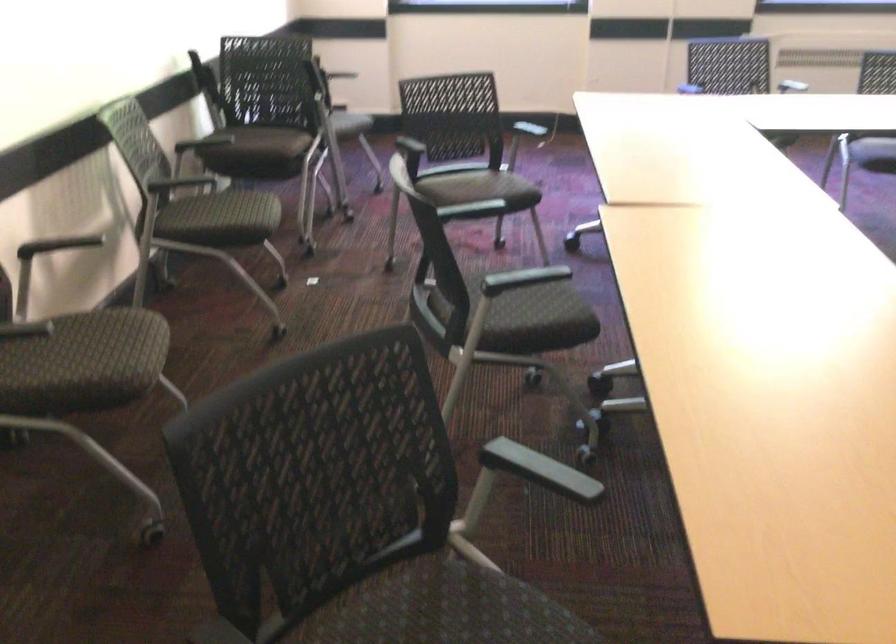
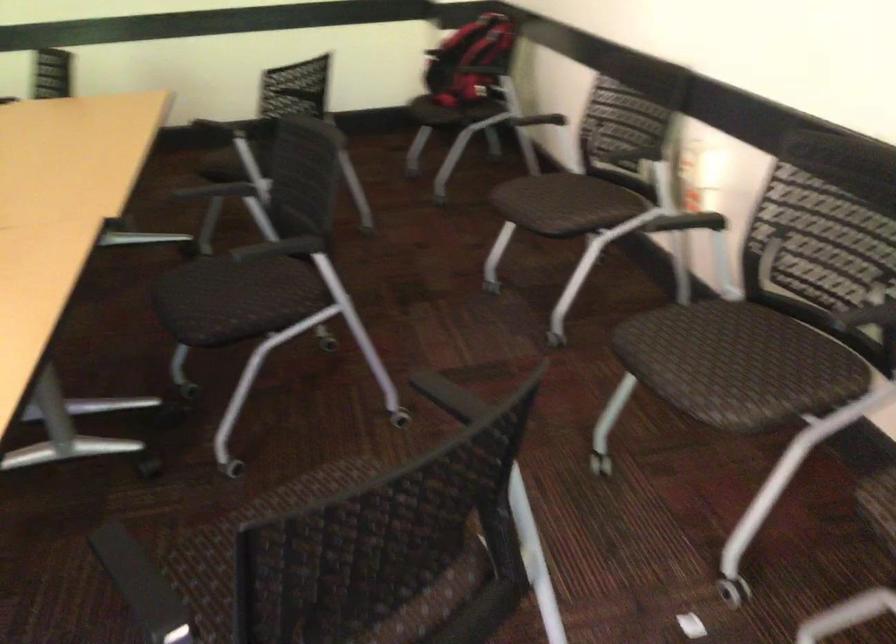
In the second image, find the point that corresponds to (x=211, y=216) in the first image.

(735, 335)